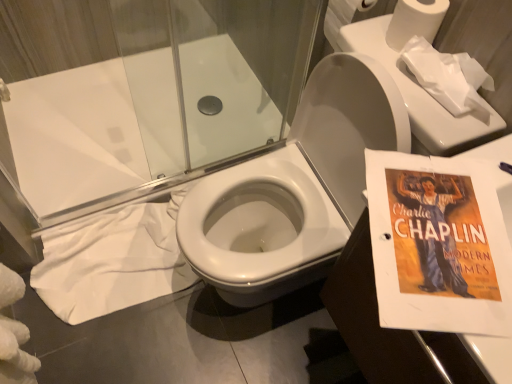
At what (x,y) coordinates should I click in order to perform the action: click on vacant region to the left of white matte toilet paper at upper right, the second toilet paper viewed from the front. Please return your answer as a coordinate pair (x, y). The width and height of the screenshot is (512, 384). Looking at the image, I should click on (365, 42).